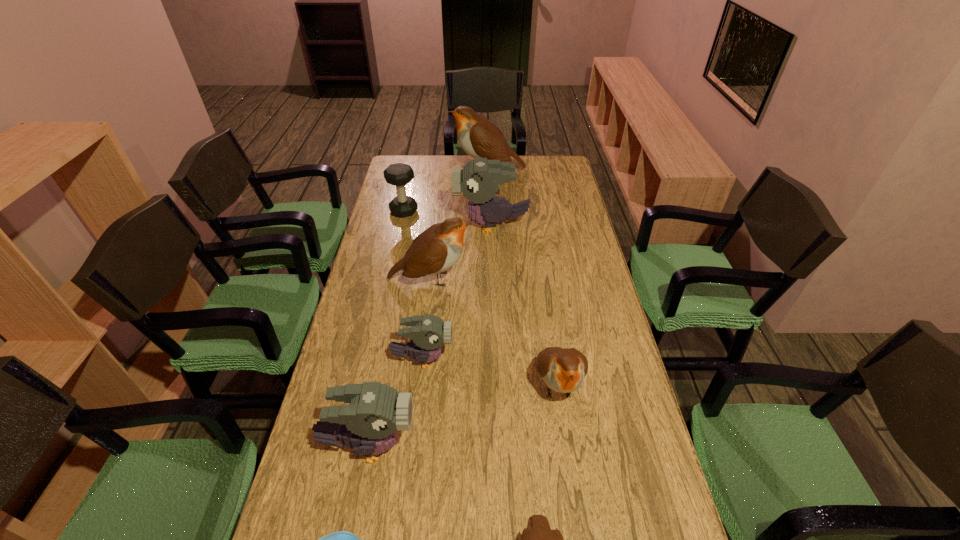
Where is `vacant space located on the right of the gray dumbbell`? The height and width of the screenshot is (540, 960). vacant space located on the right of the gray dumbbell is located at coordinates (482, 211).

This screenshot has height=540, width=960. I want to click on free space located at the beak of the smallest gray bird, so click(515, 360).

Identify the location of object that is at the far edge. This screenshot has width=960, height=540. (479, 138).

Locate an element on the screen. This screenshot has width=960, height=540. dumbbell that is at the left edge is located at coordinates (399, 174).

You are a GUI agent. You are given a task and a screenshot of the screen. Output one action in this format:
    pyautogui.click(x=<x>, y=<y>)
    Task: Click on the object that is positioned at the right edge
    The width and height of the screenshot is (960, 540).
    Given the screenshot: What is the action you would take?
    pyautogui.click(x=563, y=370)

In the image, there is a desktop. At what (x,y) coordinates should I click in order to perform the action: click on blank space at the far edge. Please return your answer as a coordinate pair (x, y). This screenshot has width=960, height=540. Looking at the image, I should click on (435, 156).

Where is `free region at the left edge of the desktop`? This screenshot has width=960, height=540. free region at the left edge of the desktop is located at coordinates (376, 375).

At what (x,y) coordinates should I click in order to perform the action: click on vacant area at the right edge of the desktop. Please return your answer as a coordinate pair (x, y). This screenshot has width=960, height=540. Looking at the image, I should click on click(x=588, y=271).

This screenshot has width=960, height=540. I want to click on free space between the second farthest gray bird and the biggest gray bird, so click(457, 293).

Image resolution: width=960 pixels, height=540 pixels. I want to click on free space between the second nearest brown bird and the farthest bird, so click(x=522, y=277).